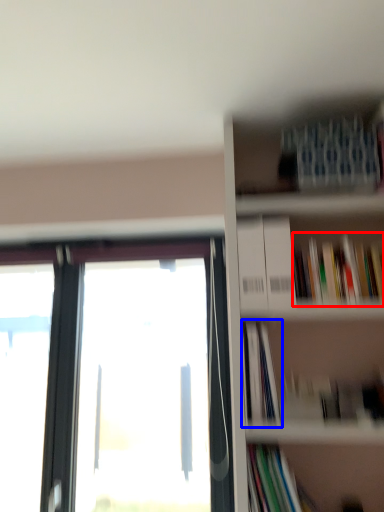
Question: Among these objects, which one is nearest to the camera, book (highlighted by a red box) or book (highlighted by a blue box)?

Choices:
 (A) book
 (B) book

Answer: (B)